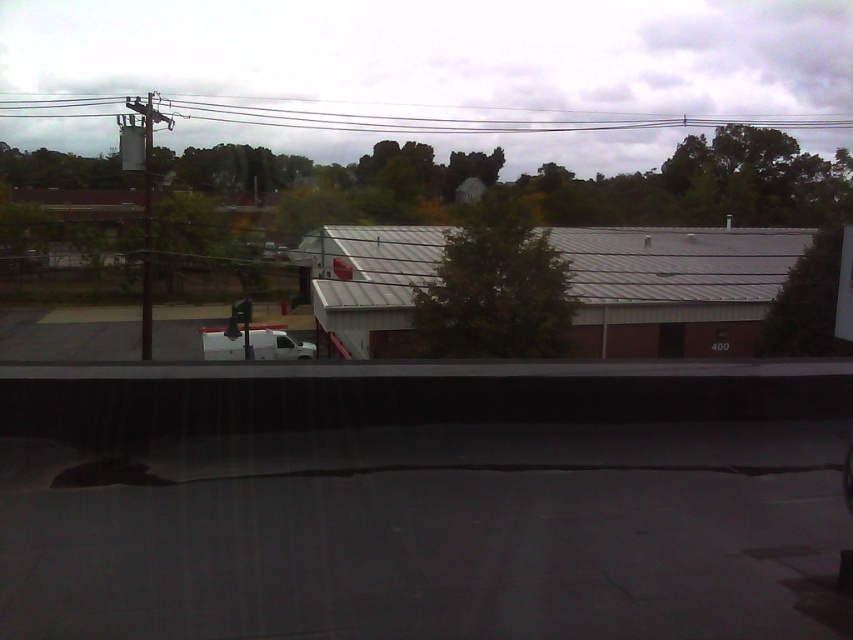
Between metallic gray shed at center and green leafy tree at center, which one has more height?

With more height is green leafy tree at center.

Find the location of `metallic gray shed at center`. metallic gray shed at center is located at coordinates (674, 288).

Describe the element at coordinates (674, 288) in the screenshot. I see `metallic gray shed at center` at that location.

Is point (360, 348) less distant than point (579, 124)?

That is True.

Where is `metallic gray shed at center`? The image size is (853, 640). metallic gray shed at center is located at coordinates (674, 288).

Between point (529, 332) and point (811, 284), which one is positioned behind?

The point (811, 284) is more distant.

Does point (485, 260) come closer to viewer compared to point (801, 310)?

Yes, point (485, 260) is closer to viewer.

What do you see at coordinates (495, 289) in the screenshot? Image resolution: width=853 pixels, height=640 pixels. I see `green leafy tree at center` at bounding box center [495, 289].

Where is `green leafy tree at center`? green leafy tree at center is located at coordinates (495, 289).